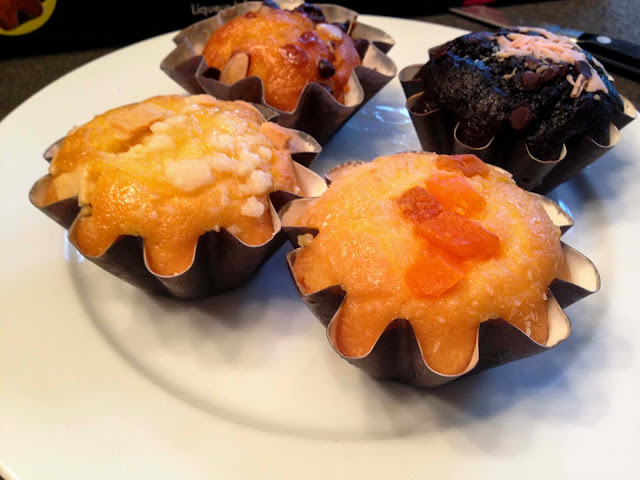
The image size is (640, 480). I want to click on white plate, so click(36, 337), click(614, 375), click(138, 62), click(416, 43).